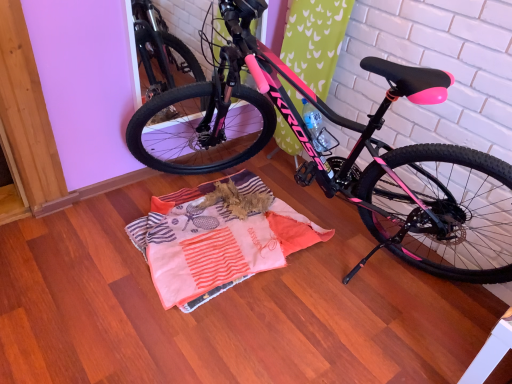
Question: Is striped cotton blanket at center to the left or to the right of pink matte bicycle at center in the image?

Choices:
 (A) left
 (B) right

Answer: (A)

Question: From their relative heights in the image, would you say striped cotton blanket at center is taller or shorter than pink matte bicycle at center?

Choices:
 (A) tall
 (B) short

Answer: (B)

Question: From a real-world perspective, is striped cotton blanket at center above or below pink matte bicycle at center?

Choices:
 (A) below
 (B) above

Answer: (A)

Question: Based on their sizes in the image, would you say pink matte bicycle at center is bigger or smaller than striped cotton blanket at center?

Choices:
 (A) small
 (B) big

Answer: (B)

Question: From the image's perspective, is pink matte bicycle at center located above or below striped cotton blanket at center?

Choices:
 (A) below
 (B) above

Answer: (B)

Question: Relative to striped cotton blanket at center, is pink matte bicycle at center in front or behind?

Choices:
 (A) behind
 (B) front

Answer: (B)

Question: From a real-world perspective, is pink matte bicycle at center above or below striped cotton blanket at center?

Choices:
 (A) above
 (B) below

Answer: (A)